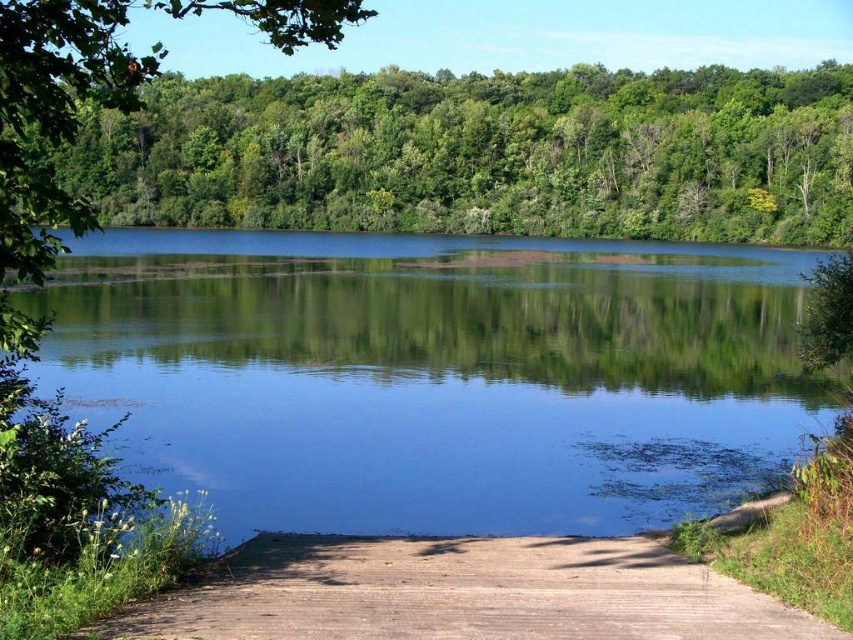
Does clear water at center have a larger size compared to green leafy tree at upper center?

No.

Who is taller, clear water at center or green leafy tree at upper center?

green leafy tree at upper center

Identify the location of clear water at center. (434, 376).

Is point (215, 600) less distant than point (45, 220)?

Yes, point (215, 600) is in front of point (45, 220).

Is point (434, 548) more distant than point (51, 184)?

That is True.

This screenshot has width=853, height=640. Identify the location of brown wooden path at lower center. (460, 593).

Locate an element on the screen. The height and width of the screenshot is (640, 853). brown wooden path at lower center is located at coordinates (460, 593).

Does green leafy trees at upper center have a greater width compared to brown wooden path at lower center?

Yes.

Image resolution: width=853 pixels, height=640 pixels. What are the coordinates of `green leafy trees at upper center` in the screenshot? It's located at (482, 154).